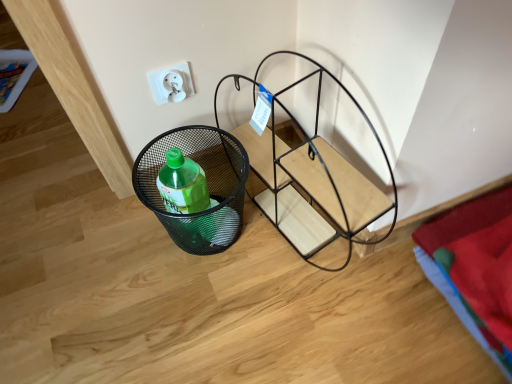
What is the approximate height of white plastic electric outlet at upper center?

white plastic electric outlet at upper center is 3.65 inches tall.

You are a GUI agent. You are given a task and a screenshot of the screen. Output one action in this format:
    pyautogui.click(x=<x>, y=<y>)
    Task: Click on the black mesh basket at lower left
    
    Given the screenshot: What is the action you would take?
    pyautogui.click(x=207, y=185)

Could you measure the distance between black metal wire basket at lower left and white plastic electric outlet at upper center?

They are 31.28 centimeters apart.

Is there a large distance between black metal wire basket at lower left and white plastic electric outlet at upper center?

black metal wire basket at lower left is actually quite close to white plastic electric outlet at upper center.

Does black metal wire basket at lower left appear on the left side of white plastic electric outlet at upper center?

In fact, black metal wire basket at lower left is to the right of white plastic electric outlet at upper center.

Would you say black metal wire basket at lower left contains white plastic electric outlet at upper center?

Actually, white plastic electric outlet at upper center is outside black metal wire basket at lower left.

Is the surface of black mesh basket at lower left in direct contact with white plastic electric outlet at upper center?

No.

Considering the sizes of objects black mesh basket at lower left and white plastic electric outlet at upper center in the image provided, who is bigger, black mesh basket at lower left or white plastic electric outlet at upper center?

black mesh basket at lower left.

From a real-world perspective, which object rests below the other?

black mesh basket at lower left, from a real-world perspective.

How different are the orientations of black mesh basket at lower left and white plastic electric outlet at upper center in degrees?

black mesh basket at lower left and white plastic electric outlet at upper center are facing 86.8 degrees away from each other.

Looking at this image, considering the positions of objects white plastic electric outlet at upper center and black mesh basket at lower left in the image provided, who is more to the left, white plastic electric outlet at upper center or black mesh basket at lower left?

From the viewer's perspective, white plastic electric outlet at upper center appears more on the left side.

Is white plastic electric outlet at upper center not within black mesh basket at lower left?

Yes.

Is white plastic electric outlet at upper center positioned in front of black mesh basket at lower left?

No, the depth of white plastic electric outlet at upper center is greater than that of black mesh basket at lower left.

Measure the distance between white plastic electric outlet at upper center and black mesh basket at lower left.

white plastic electric outlet at upper center is 8.65 inches from black mesh basket at lower left.

From a real-world perspective, relative to black mesh basket at lower left, is black metal wire basket at lower left vertically above or below?

black metal wire basket at lower left is situated higher than black mesh basket at lower left in the real world.

From their relative heights in the image, would you say black metal wire basket at lower left is taller or shorter than black mesh basket at lower left?

In the image, black metal wire basket at lower left appears to be taller than black mesh basket at lower left.

Who is smaller, black mesh basket at lower left or black metal wire basket at lower left?

black mesh basket at lower left is smaller.

Which is less distant, (150, 148) or (307, 241)?

Point (150, 148) appears to be closer to the viewer than point (307, 241).

From a real-world perspective, is black mesh basket at lower left over black metal wire basket at lower left?

No, from a real-world perspective, black mesh basket at lower left is not on top of black metal wire basket at lower left.

Identify the location of basket on the left of black metal wire basket at lower left. (207, 185).

Can you confirm if white plastic electric outlet at upper center is smaller than black metal wire basket at lower left?

Yes, white plastic electric outlet at upper center is smaller than black metal wire basket at lower left.

Could you tell me if white plastic electric outlet at upper center is facing black metal wire basket at lower left?

No, white plastic electric outlet at upper center does not turn towards black metal wire basket at lower left.

Which is further, (172, 100) or (336, 237)?

The point (336, 237) is behind.

The height and width of the screenshot is (384, 512). I want to click on furniture on the right of white plastic electric outlet at upper center, so click(x=313, y=181).

Locate an element on the screen. The height and width of the screenshot is (384, 512). basket located underneath the white plastic electric outlet at upper center (from a real-world perspective) is located at coordinates (207, 185).

From the image, which object appears to be nearer to black mesh basket at lower left, black metal wire basket at lower left or white plastic electric outlet at upper center?

black metal wire basket at lower left.

Estimate the real-world distances between objects in this image. Which object is further from black metal wire basket at lower left, white plastic electric outlet at upper center or black mesh basket at lower left?

white plastic electric outlet at upper center is further to black metal wire basket at lower left.

When comparing their distances from white plastic electric outlet at upper center, does black mesh basket at lower left or black metal wire basket at lower left seem further?

Among the two, black metal wire basket at lower left is located further to white plastic electric outlet at upper center.

Estimate the real-world distances between objects in this image. Which object is closer to black metal wire basket at lower left, black mesh basket at lower left or white plastic electric outlet at upper center?

black mesh basket at lower left.

Based on their spatial positions, is white plastic electric outlet at upper center or black metal wire basket at lower left closer to black mesh basket at lower left?

Among the two, black metal wire basket at lower left is located nearer to black mesh basket at lower left.

From the image, which object appears to be farther from white plastic electric outlet at upper center, black metal wire basket at lower left or black mesh basket at lower left?

black metal wire basket at lower left is positioned further to the anchor white plastic electric outlet at upper center.

This screenshot has width=512, height=384. Identify the location of basket located between white plastic electric outlet at upper center and black metal wire basket at lower left in the left-right direction. (207, 185).